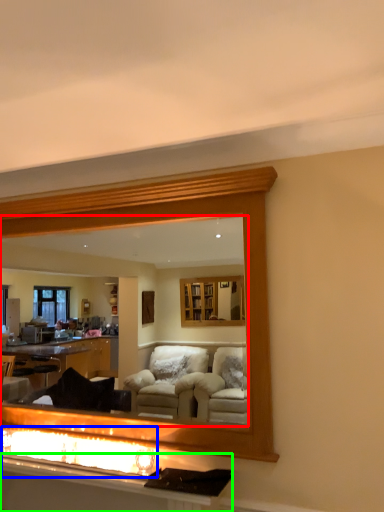
Question: Based on their relative distances, which object is nearer to mirror (highlighted by a red box)? Choose from reflection (highlighted by a blue box) and vanity (highlighted by a green box).

Choices:
 (A) reflection
 (B) vanity

Answer: (A)